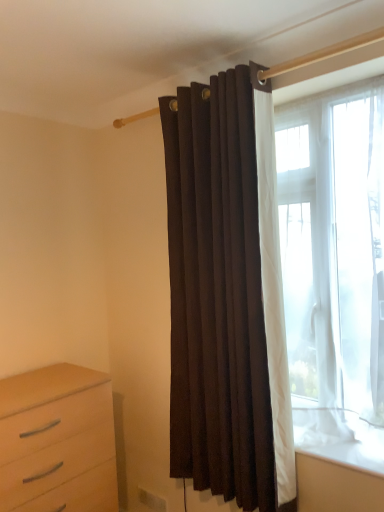
Question: Can you confirm if transparent fabric window at right is smaller than suede-like brown curtain at center?

Choices:
 (A) no
 (B) yes

Answer: (B)

Question: Is transparent fabric window at right not inside suede-like brown curtain at center?

Choices:
 (A) no
 (B) yes

Answer: (B)

Question: Considering the relative positions of transparent fabric window at right and suede-like brown curtain at center in the image provided, is transparent fabric window at right to the left of suede-like brown curtain at center from the viewer's perspective?

Choices:
 (A) no
 (B) yes

Answer: (A)

Question: Is suede-like brown curtain at center inside transparent fabric window at right?

Choices:
 (A) yes
 (B) no

Answer: (B)

Question: Is transparent fabric window at right taller than suede-like brown curtain at center?

Choices:
 (A) yes
 (B) no

Answer: (B)

Question: Does point (311, 165) appear closer or farther from the camera than point (208, 304)?

Choices:
 (A) closer
 (B) farther

Answer: (A)

Question: Is transparent fabric window at right wider or thinner than suede-like brown curtain at center?

Choices:
 (A) wide
 (B) thin

Answer: (A)

Question: Based on their positions, is transparent fabric window at right located to the left or right of suede-like brown curtain at center?

Choices:
 (A) right
 (B) left

Answer: (A)

Question: Considering their positions, is transparent fabric window at right located in front of or behind suede-like brown curtain at center?

Choices:
 (A) front
 (B) behind

Answer: (A)

Question: Do you think transparent fabric window at right is within light wood chest of drawers at lower left, or outside of it?

Choices:
 (A) outside
 (B) inside

Answer: (A)

Question: Is transparent fabric window at right taller or shorter than light wood chest of drawers at lower left?

Choices:
 (A) short
 (B) tall

Answer: (B)

Question: From a real-world perspective, relative to light wood chest of drawers at lower left, is transparent fabric window at right vertically above or below?

Choices:
 (A) above
 (B) below

Answer: (A)

Question: Is point (322, 445) closer or farther from the camera than point (44, 388)?

Choices:
 (A) closer
 (B) farther

Answer: (A)

Question: Considering the relative positions of suede-like brown curtain at center and transparent fabric window at right in the image provided, is suede-like brown curtain at center to the left or to the right of transparent fabric window at right?

Choices:
 (A) left
 (B) right

Answer: (A)

Question: Looking at the image, does suede-like brown curtain at center seem bigger or smaller compared to transparent fabric window at right?

Choices:
 (A) big
 (B) small

Answer: (A)